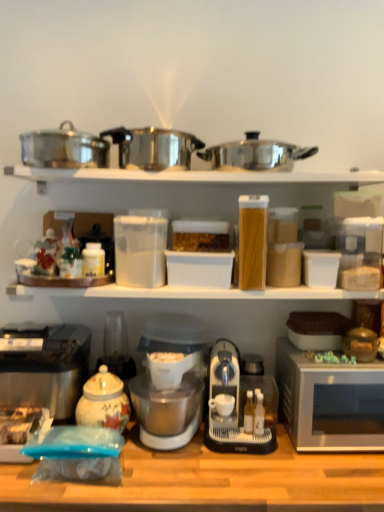
The image size is (384, 512). Identify the location of free space in front of sleek metallic coffee machine at center. (250, 473).